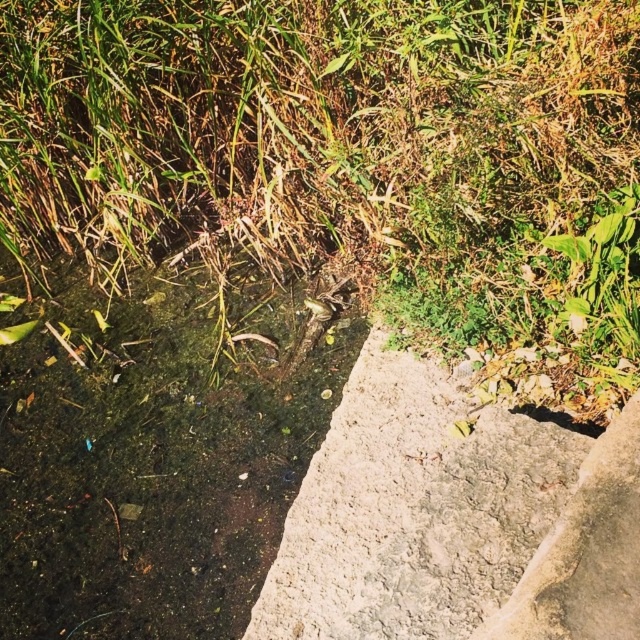
Question: Which object appears farthest from the camera in this image?

Choices:
 (A) gray concrete wall at center
 (B) green grass at center
 (C) green algae water at center

Answer: (C)

Question: Can you confirm if green grass at center is positioned above gray concrete wall at center?

Choices:
 (A) no
 (B) yes

Answer: (B)

Question: Which of the following is the closest to the observer?

Choices:
 (A) green grass at center
 (B) gray concrete wall at center
 (C) green algae water at center

Answer: (B)

Question: Is green algae water at center smaller than gray concrete wall at center?

Choices:
 (A) no
 (B) yes

Answer: (A)

Question: In this image, where is green grass at center located relative to green algae water at center?

Choices:
 (A) below
 (B) above

Answer: (B)

Question: Among these objects, which one is farthest from the camera?

Choices:
 (A) gray concrete wall at center
 (B) green grass at center

Answer: (B)